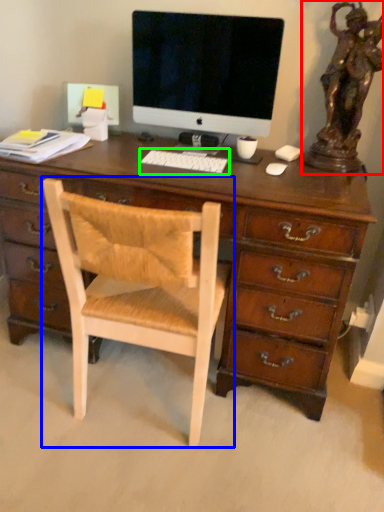
Question: Which object is positioned farthest from bronze statue (highlighted by a red box)? Select from chair (highlighted by a blue box) and computer keyboard (highlighted by a green box).

Choices:
 (A) chair
 (B) computer keyboard

Answer: (A)